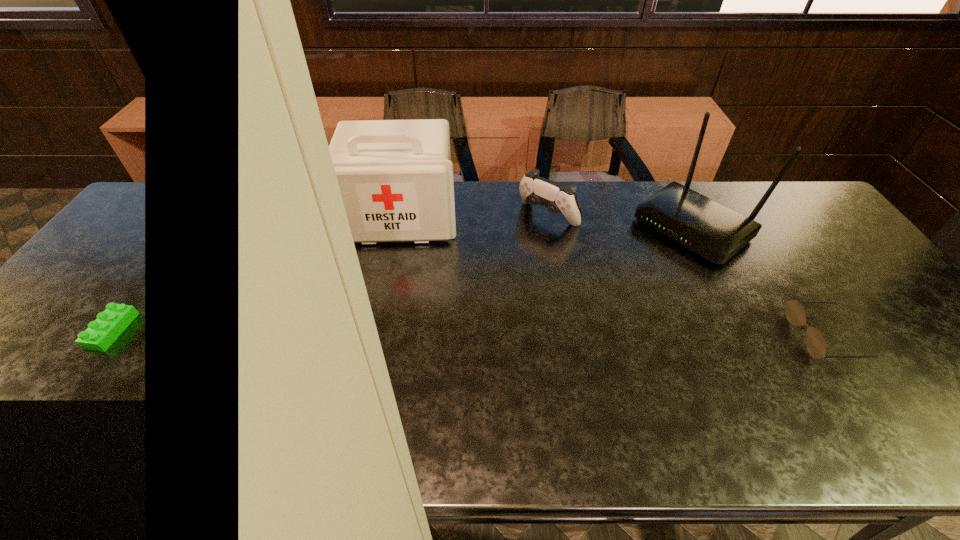
Image resolution: width=960 pixels, height=540 pixels. Identify the location of free space located on the front-facing side of the leftmost object. (384, 341).

Locate an element on the screen. vacant space located 0.130m on the front-facing side of the leftmost object is located at coordinates (393, 279).

This screenshot has width=960, height=540. I want to click on free spot located on the front-facing side of the control, so click(508, 252).

Where is `free point located 0.110m on the front-facing side of the control`? This screenshot has height=540, width=960. free point located 0.110m on the front-facing side of the control is located at coordinates (512, 248).

Image resolution: width=960 pixels, height=540 pixels. I want to click on free space located 0.120m on the front-facing side of the control, so click(510, 250).

The image size is (960, 540). In order to click on free space located 0.070m on the front-facing side of the router in this screenshot , I will do `click(645, 264)`.

At what (x,y) coordinates should I click in order to perform the action: click on vacant area situated on the front-facing side of the router. Please return your answer as a coordinate pair (x, y). Looking at the image, I should click on (580, 312).

What are the coordinates of `free space located on the front-facing side of the router` in the screenshot? It's located at (623, 280).

Identify the location of the first-aid kit at the far edge. The height and width of the screenshot is (540, 960). (395, 177).

You are a GUI agent. You are given a task and a screenshot of the screen. Output one action in this format:
    pyautogui.click(x=<x>, y=<y>)
    Task: Click on the control that is positioned at the far edge
    The width and height of the screenshot is (960, 540).
    Given the screenshot: What is the action you would take?
    pyautogui.click(x=535, y=190)